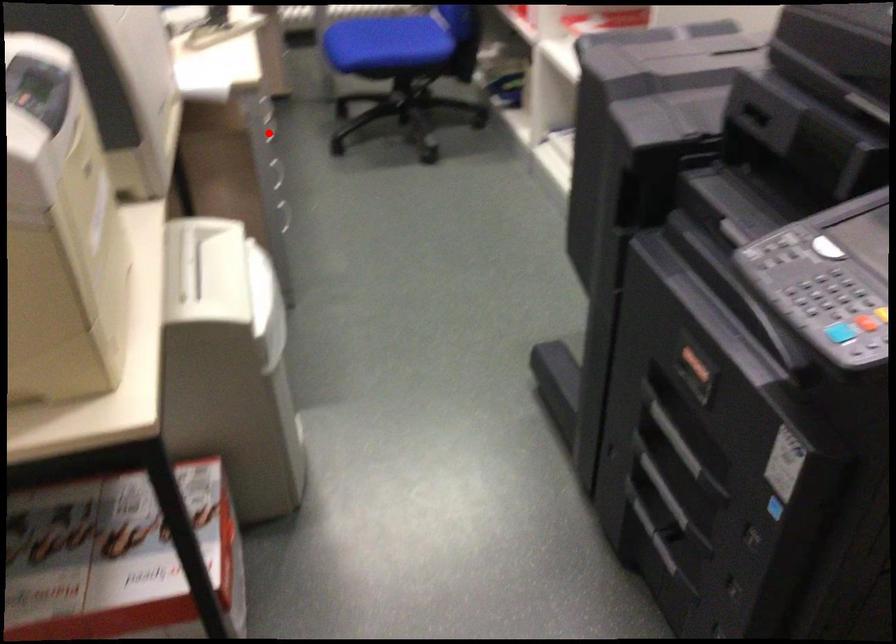
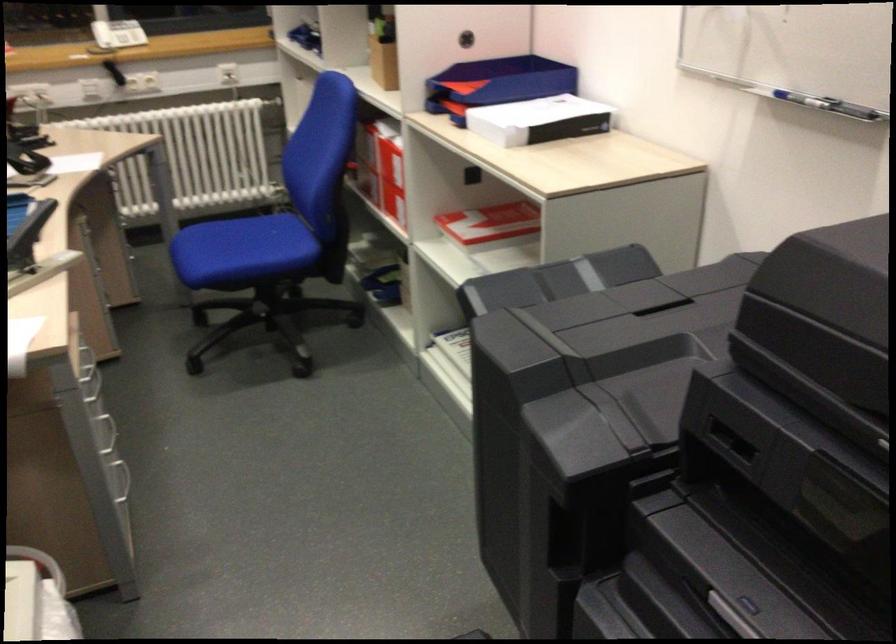
Question: I am providing you with two images of the same scene from different viewpoints. A red point is shown in image1. For the corresponding object point in image2, is it positioned nearer or farther from the camera?

Choices:
 (A) Nearer
 (B) Farther

Answer: (A)